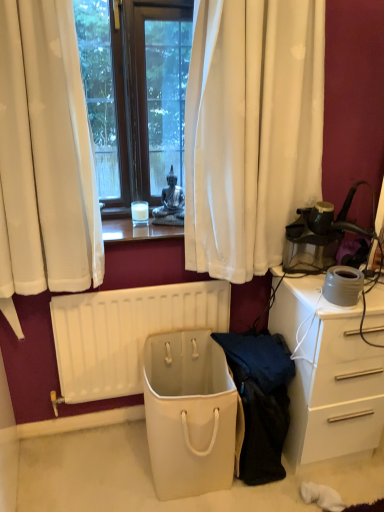
Question: Is white glossy desk at right to the left of beige fabric bag at center from the viewer's perspective?

Choices:
 (A) no
 (B) yes

Answer: (A)

Question: Can you confirm if white glossy desk at right is bigger than beige fabric bag at center?

Choices:
 (A) no
 (B) yes

Answer: (B)

Question: Considering the relative positions of white glossy desk at right and beige fabric bag at center in the image provided, is white glossy desk at right to the right of beige fabric bag at center from the viewer's perspective?

Choices:
 (A) no
 (B) yes

Answer: (B)

Question: Would you say white glossy desk at right contains beige fabric bag at center?

Choices:
 (A) no
 (B) yes

Answer: (A)

Question: Is white glossy desk at right positioned in front of beige fabric bag at center?

Choices:
 (A) no
 (B) yes

Answer: (A)

Question: In the image, is dark blue fabric at center positioned in front of or behind white matte radiator at lower center?

Choices:
 (A) front
 (B) behind

Answer: (A)

Question: Is point (243, 415) closer or farther from the camera than point (87, 376)?

Choices:
 (A) closer
 (B) farther

Answer: (A)

Question: From a real-world perspective, is dark blue fabric at center above or below white matte radiator at lower center?

Choices:
 (A) below
 (B) above

Answer: (A)

Question: Do you think dark blue fabric at center is within white matte radiator at lower center, or outside of it?

Choices:
 (A) inside
 (B) outside

Answer: (B)

Question: In terms of width, does white glossy desk at right look wider or thinner when compared to beige fabric bag at center?

Choices:
 (A) thin
 (B) wide

Answer: (B)

Question: From the image's perspective, is white glossy desk at right above or below beige fabric bag at center?

Choices:
 (A) above
 (B) below

Answer: (A)

Question: From their relative heights in the image, would you say white glossy desk at right is taller or shorter than beige fabric bag at center?

Choices:
 (A) tall
 (B) short

Answer: (A)

Question: From a real-world perspective, relative to beige fabric bag at center, is white glossy desk at right vertically above or below?

Choices:
 (A) below
 (B) above

Answer: (B)

Question: Is white matte radiator at lower center bigger or smaller than beige fabric bag at center?

Choices:
 (A) small
 (B) big

Answer: (A)

Question: Would you say white matte radiator at lower center is to the left or to the right of beige fabric bag at center in the picture?

Choices:
 (A) right
 (B) left

Answer: (B)